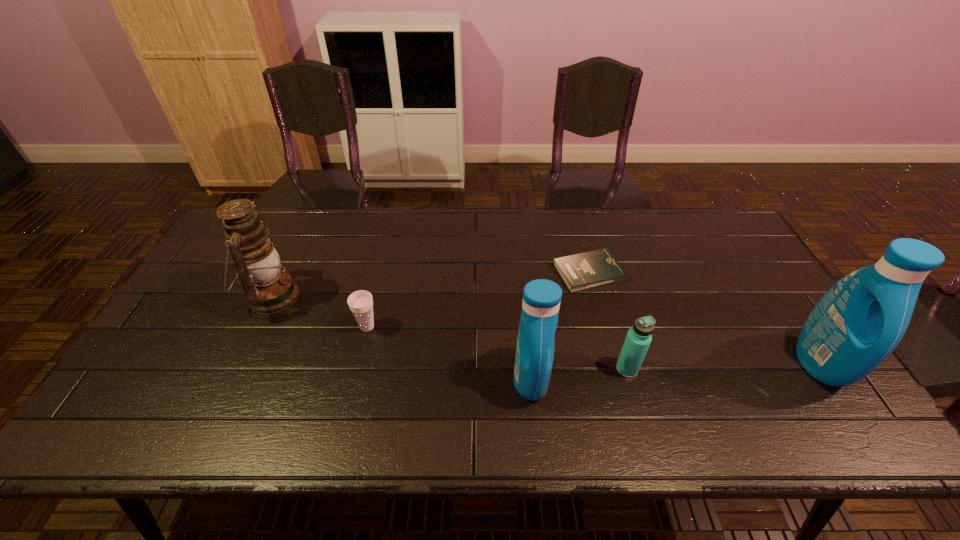
Find the location of a particular element. The image size is (960, 540). vacant space at the far left corner of the desktop is located at coordinates (272, 225).

The image size is (960, 540). What are the coordinates of `free spot at the far right corner of the desktop` in the screenshot? It's located at (716, 240).

Locate an element on the screen. The width and height of the screenshot is (960, 540). vacant space in between the fourth tallest object and the right detergent is located at coordinates (724, 366).

You are a GUI agent. You are given a task and a screenshot of the screen. Output one action in this format:
    pyautogui.click(x=<x>, y=<y>)
    Task: Click on the vacant space in between the shortest object and the leftmost object
    The image size is (960, 540).
    Given the screenshot: What is the action you would take?
    pyautogui.click(x=430, y=285)

The width and height of the screenshot is (960, 540). In order to click on free space between the right detergent and the fifth tallest object in this screenshot , I will do click(x=593, y=345).

This screenshot has width=960, height=540. Identify the location of unoccupied position between the right detergent and the book. (705, 318).

You are a GUI agent. You are given a task and a screenshot of the screen. Output one action in this format:
    pyautogui.click(x=<x>, y=<y>)
    Task: Click on the blank region between the book and the cup
    
    Given the screenshot: What is the action you would take?
    pyautogui.click(x=478, y=300)

Where is `free space that is in between the third shortest object and the rightmost object`? free space that is in between the third shortest object and the rightmost object is located at coordinates (724, 366).

Locate an element on the screen. The height and width of the screenshot is (540, 960). empty space between the thermos bottle and the rightmost object is located at coordinates (724, 366).

Locate an element on the screen. The height and width of the screenshot is (540, 960). empty location between the shorter detergent and the right detergent is located at coordinates (676, 370).